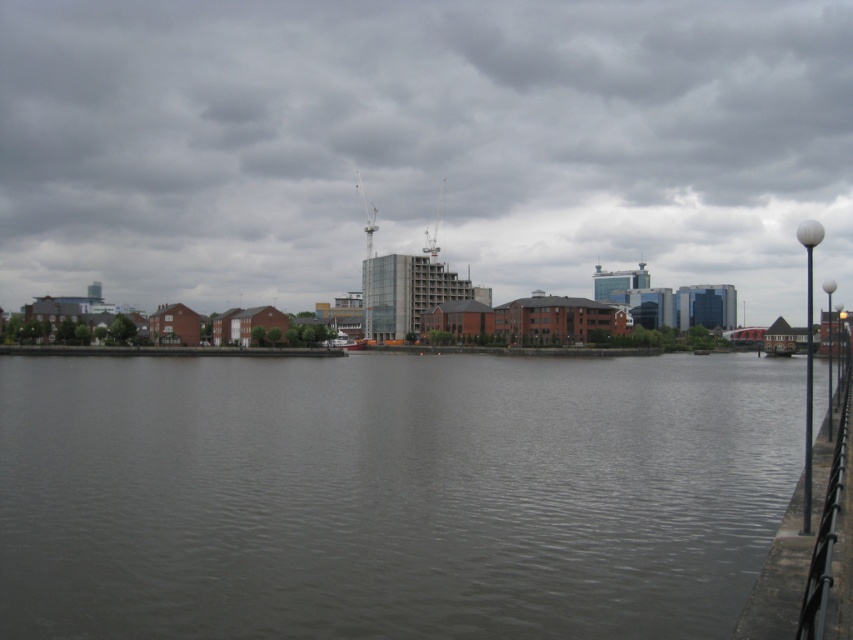
Question: Is transparent glass buildings at center above gray concrete river at center?

Choices:
 (A) no
 (B) yes

Answer: (B)

Question: Which of the following is the closest to the observer?

Choices:
 (A) (820, 412)
 (B) (209, 230)

Answer: (A)

Question: Which point is farther to the camera?

Choices:
 (A) (344, 500)
 (B) (144, 246)

Answer: (B)

Question: Observing the image, what is the correct spatial positioning of transparent glass buildings at center in reference to gray concrete river at center?

Choices:
 (A) right
 (B) left

Answer: (B)

Question: Which point is closer to the camera?

Choices:
 (A) (585, 572)
 (B) (41, 280)

Answer: (A)

Question: Is transparent glass buildings at center above gray concrete river at center?

Choices:
 (A) no
 (B) yes

Answer: (B)